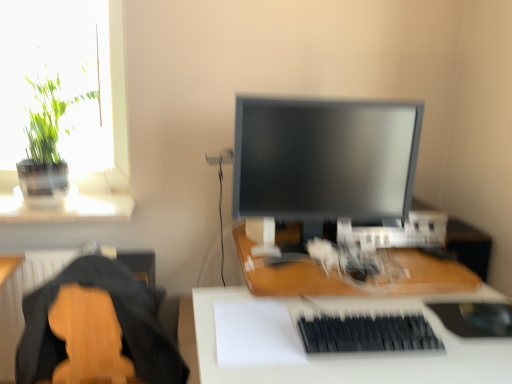
Question: Can you confirm if wooden desk at center, which appears as the second desk when ordered from the bottom, is smaller than wooden guitar at lower left?

Choices:
 (A) yes
 (B) no

Answer: (A)

Question: Is wooden desk at center, arranged as the 1th desk when viewed from the top, in front of wooden guitar at lower left?

Choices:
 (A) no
 (B) yes

Answer: (A)

Question: Can you confirm if wooden desk at center, arranged as the 1th desk when viewed from the top, is shorter than wooden guitar at lower left?

Choices:
 (A) yes
 (B) no

Answer: (A)

Question: Is wooden desk at center, which appears as the second desk when ordered from the bottom, turned away from wooden guitar at lower left?

Choices:
 (A) yes
 (B) no

Answer: (B)

Question: Is wooden desk at center, which appears as the second desk when ordered from the bottom, to the left of wooden guitar at lower left from the viewer's perspective?

Choices:
 (A) no
 (B) yes

Answer: (A)

Question: Is there a large distance between wooden desk at center, arranged as the 1th desk when viewed from the top, and wooden guitar at lower left?

Choices:
 (A) no
 (B) yes

Answer: (A)

Question: From the image's perspective, does black rubber mousepad at lower right appear lower than green leafy plant at upper left?

Choices:
 (A) yes
 (B) no

Answer: (A)

Question: Is the position of black rubber mousepad at lower right less distant than that of green leafy plant at upper left?

Choices:
 (A) yes
 (B) no

Answer: (A)

Question: Is black rubber mousepad at lower right thinner than green leafy plant at upper left?

Choices:
 (A) no
 (B) yes

Answer: (B)

Question: Can you confirm if black rubber mousepad at lower right is wider than green leafy plant at upper left?

Choices:
 (A) yes
 (B) no

Answer: (B)

Question: From a real-world perspective, is black rubber mousepad at lower right on green leafy plant at upper left?

Choices:
 (A) no
 (B) yes

Answer: (A)

Question: Is black rubber mousepad at lower right not near green leafy plant at upper left?

Choices:
 (A) no
 (B) yes

Answer: (B)

Question: Can you confirm if wooden desk at center, which appears as the second desk when ordered from the bottom, is smaller than white matte desk at center, positioned as the second desk in top-to-bottom order?

Choices:
 (A) no
 (B) yes

Answer: (B)